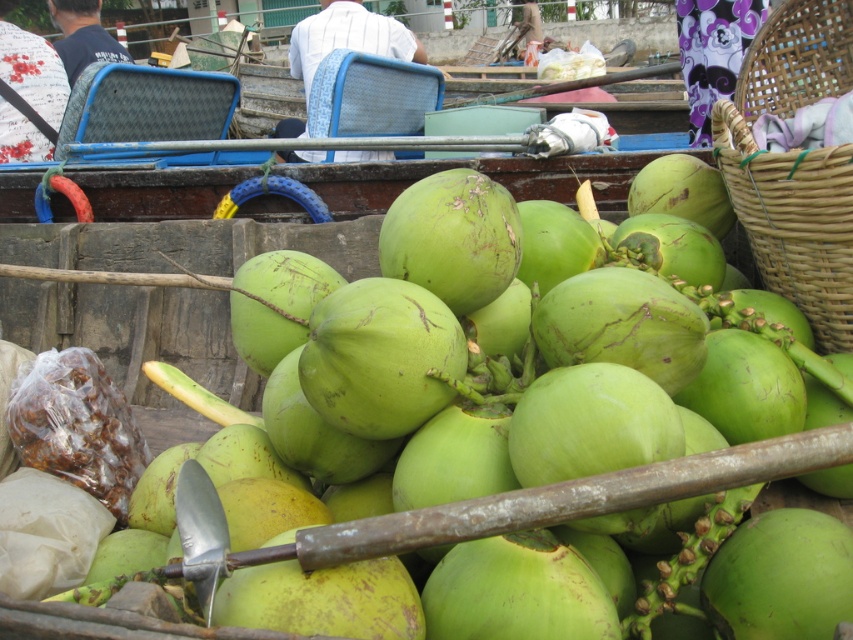
You are a vendor at the floating market and need to stack items on a small shelf. The shelf can only hold items that are shorter than the woven bamboo basket at right. Can you place the green rough coconut at center on the shelf?

The green rough coconut at center is not as tall as the woven bamboo basket at right, so it can be placed on the shelf since it is shorter.

You are a vendor at the floating market and need to place a green rough coconut at center and a woven bamboo basket at right on a shelf. Which item requires a wider space on the shelf?

The green rough coconut at center requires a wider space on the shelf because its width surpasses that of the woven bamboo basket at right.